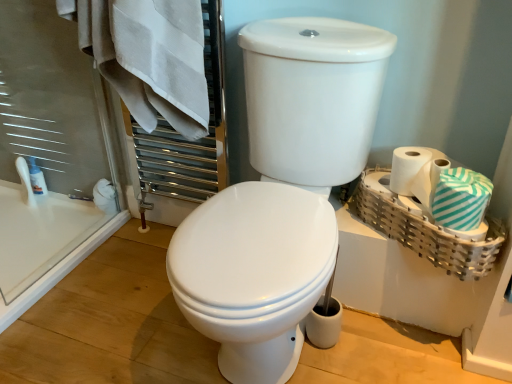
The image size is (512, 384). What are the coordinates of `white matte toilet paper at right` in the screenshot? It's located at (417, 172).

What is the approximate width of teal striped fabric at right, which ranks as the 1th bath towel in right-to-left order?

5.05 inches.

The image size is (512, 384). Find the location of `white glossy lotion at left`. white glossy lotion at left is located at coordinates (37, 178).

Locate an element on the screen. This screenshot has height=384, width=512. white glossy toilet at center is located at coordinates (281, 193).

Locate an element on the screen. This screenshot has width=512, height=384. white cotton towel at upper left, positioned as the 1th bath towel in left-to-right order is located at coordinates (148, 57).

Is teal striped fabric at right, positioned as the second bath towel in left-to-right order, thinner than white matte toilet paper at right?

No, teal striped fabric at right, positioned as the second bath towel in left-to-right order, is not thinner than white matte toilet paper at right.

In the scene shown: Is teal striped fabric at right, which is counted as the 2th bath towel, starting from the top, beside white matte toilet paper at right?

Yes.

Identify the location of toilet paper located above the teal striped fabric at right, which is the first bath towel from bottom to top (from the image's perspective). Image resolution: width=512 pixels, height=384 pixels. (417, 172).

How many degrees apart are the facing directions of teal striped fabric at right, positioned as the second bath towel in left-to-right order, and white matte toilet paper at right?

Answer: 0.00125 degrees separate the facing orientations of teal striped fabric at right, positioned as the second bath towel in left-to-right order, and white matte toilet paper at right.

Which of these two, teal striped fabric at right, which is counted as the 2th bath towel, starting from the top, or white glossy toilet at center, is thinner?

With smaller width is teal striped fabric at right, which is counted as the 2th bath towel, starting from the top.

From the picture: Is teal striped fabric at right, which ranks as the 1th bath towel in right-to-left order, oriented away from white glossy toilet at center?

teal striped fabric at right, which ranks as the 1th bath towel in right-to-left order, does not have its back to white glossy toilet at center.

Identify the location of toilet directly beneath the teal striped fabric at right, which ranks as the 1th bath towel in right-to-left order (from a real-world perspective). This screenshot has height=384, width=512. point(281,193).

Based on the photo, from the image's perspective, is teal striped fabric at right, positioned as the second bath towel in left-to-right order, on white glossy toilet at center?

Indeed, from the image's perspective, teal striped fabric at right, positioned as the second bath towel in left-to-right order, is shown above white glossy toilet at center.

How much distance is there between white cotton towel at upper left, which is counted as the second bath towel, starting from the bottom, and teal striped fabric at right, which ranks as the 1th bath towel in right-to-left order?

A distance of 32.48 inches exists between white cotton towel at upper left, which is counted as the second bath towel, starting from the bottom, and teal striped fabric at right, which ranks as the 1th bath towel in right-to-left order.

Is white cotton towel at upper left, which is counted as the second bath towel, starting from the bottom, turned away from teal striped fabric at right, which is the first bath towel from bottom to top?

No, white cotton towel at upper left, which is counted as the second bath towel, starting from the bottom,'s orientation is not away from teal striped fabric at right, which is the first bath towel from bottom to top.

Does white cotton towel at upper left, which is counted as the second bath towel, starting from the bottom, have a lesser height compared to teal striped fabric at right, which is counted as the 2th bath towel, starting from the top?

In fact, white cotton towel at upper left, which is counted as the second bath towel, starting from the bottom, may be taller than teal striped fabric at right, which is counted as the 2th bath towel, starting from the top.

What's the angular difference between white cotton towel at upper left, the second bath towel from the right, and teal striped fabric at right, which is the first bath towel from bottom to top,'s facing directions?

The angular difference between white cotton towel at upper left, the second bath towel from the right, and teal striped fabric at right, which is the first bath towel from bottom to top, is 2.15 degrees.

From a real-world perspective, is white glossy lotion at left beneath white matte toilet paper at right?

Yes.

From the image's perspective, would you say white glossy lotion at left is positioned over white matte toilet paper at right?

Yes, from the image's perspective, white glossy lotion at left is on top of white matte toilet paper at right.

Considering the positions of objects white glossy lotion at left and white matte toilet paper at right in the image provided, who is more to the right, white glossy lotion at left or white matte toilet paper at right?

white matte toilet paper at right is more to the right.

Could you tell me if white glossy lotion at left is turned towards white matte toilet paper at right?

No, white glossy lotion at left is not oriented towards white matte toilet paper at right.

Would you say bamboo woven basket at right is outside white glossy toilet at center?

Yes, bamboo woven basket at right is located beyond the bounds of white glossy toilet at center.

Is bamboo woven basket at right beside white glossy toilet at center?

No, bamboo woven basket at right is not making contact with white glossy toilet at center.

Looking at this image, considering the relative positions of bamboo woven basket at right and white glossy toilet at center in the image provided, is bamboo woven basket at right to the left of white glossy toilet at center from the viewer's perspective?

In fact, bamboo woven basket at right is to the right of white glossy toilet at center.

Can you tell me how much white glossy lotion at left and teal striped fabric at right, which ranks as the 1th bath towel in right-to-left order, differ in facing direction?

They differ by 24.7 degrees in their facing directions.

Locate an element on the screen. Image resolution: width=512 pixels, height=384 pixels. toiletry that appears above the teal striped fabric at right, which is the first bath towel from bottom to top (from the image's perspective) is located at coordinates (37, 178).

In the image, is white glossy lotion at left positioned in front of or behind teal striped fabric at right, which ranks as the 1th bath towel in right-to-left order?

Clearly, white glossy lotion at left is behind teal striped fabric at right, which ranks as the 1th bath towel in right-to-left order.

Is white glossy lotion at left taller than teal striped fabric at right, which is counted as the 2th bath towel, starting from the top?

Indeed, white glossy lotion at left has a greater height compared to teal striped fabric at right, which is counted as the 2th bath towel, starting from the top.

Which object is positioned more to the right, bamboo woven basket at right or white matte toilet paper at right?

From the viewer's perspective, bamboo woven basket at right appears more on the right side.

From a real-world perspective, which object stands above the other?

From a 3D spatial view, white matte toilet paper at right is above.

Does point (361, 191) come closer to viewer compared to point (407, 153)?

No, (361, 191) is further to viewer.

Can you confirm if bamboo woven basket at right is wider than white matte toilet paper at right?

Yes.

In order to click on toilet paper behind the teal striped fabric at right, which ranks as the 1th bath towel in right-to-left order in this screenshot , I will do `click(417, 172)`.

From the image's perspective, count 1st bath towels upward from the white glossy toilet at center and point to it. Please provide its 2D coordinates.

[(461, 199)]

Considering their positions, is bamboo woven basket at right positioned further to white cotton towel at upper left, which appears as the 1th bath towel when viewed from the top, than white glossy lotion at left?

white glossy lotion at left is positioned further to the anchor white cotton towel at upper left, which appears as the 1th bath towel when viewed from the top.

When comparing their distances from bamboo woven basket at right, does white matte toilet paper at right or white glossy toilet at center seem further?

white glossy toilet at center.

Which object lies further to the anchor point bamboo woven basket at right, white glossy toilet at center or white glossy lotion at left?

Based on the image, white glossy lotion at left appears to be further to bamboo woven basket at right.

When comparing their distances from bamboo woven basket at right, does white glossy lotion at left or white glossy toilet at center seem closer?

white glossy toilet at center is closer to bamboo woven basket at right.

From the image, which object appears to be farther from bamboo woven basket at right, white matte toilet paper at right or white glossy lotion at left?

Based on the image, white glossy lotion at left appears to be further to bamboo woven basket at right.

Considering their positions, is teal striped fabric at right, which ranks as the 1th bath towel in right-to-left order, positioned further to bamboo woven basket at right than white glossy lotion at left?

white glossy lotion at left.

From the image, which object appears to be nearer to teal striped fabric at right, positioned as the second bath towel in left-to-right order, bamboo woven basket at right or white matte toilet paper at right?

white matte toilet paper at right is closer to teal striped fabric at right, positioned as the second bath towel in left-to-right order.

Considering their positions, is white glossy lotion at left positioned closer to teal striped fabric at right, which ranks as the 1th bath towel in right-to-left order, than white cotton towel at upper left, which appears as the 1th bath towel when viewed from the top?

white cotton towel at upper left, which appears as the 1th bath towel when viewed from the top, is closer to teal striped fabric at right, which ranks as the 1th bath towel in right-to-left order.

Identify the location of bath towel between white glossy lotion at left and white matte toilet paper at right from left to right. (148, 57).

Identify the location of toilet located between white cotton towel at upper left, the second bath towel from the right, and teal striped fabric at right, which ranks as the 1th bath towel in right-to-left order, in the left-right direction. This screenshot has height=384, width=512. (281, 193).

Image resolution: width=512 pixels, height=384 pixels. I want to click on basket between white cotton towel at upper left, which appears as the 1th bath towel when viewed from the top, and teal striped fabric at right, positioned as the second bath towel in left-to-right order, so click(428, 232).

You are a GUI agent. You are given a task and a screenshot of the screen. Output one action in this format:
    pyautogui.click(x=<x>, y=<y>)
    Task: Click on the toilet paper between white glossy lotion at left and teal striped fabric at right, which is counted as the 2th bath towel, starting from the top, in the horizontal direction
    
    Given the screenshot: What is the action you would take?
    pyautogui.click(x=417, y=172)